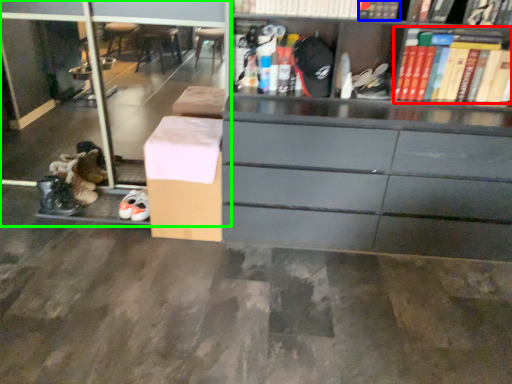
Question: Which object is positioned closest to book (highlighted by a red box)? Select from book (highlighted by a blue box) and shelf (highlighted by a green box).

Choices:
 (A) book
 (B) shelf

Answer: (A)